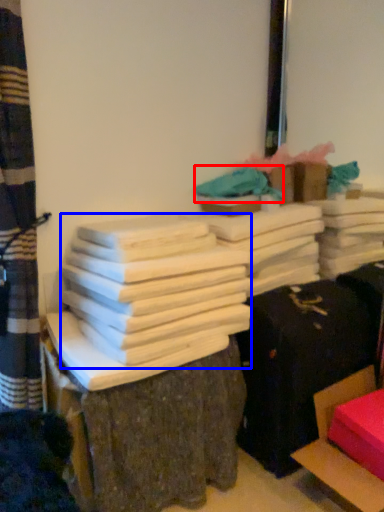
Question: Which of the following is the closest to the observer, fabric (highlighted by a red box) or bundle (highlighted by a blue box)?

Choices:
 (A) fabric
 (B) bundle

Answer: (B)